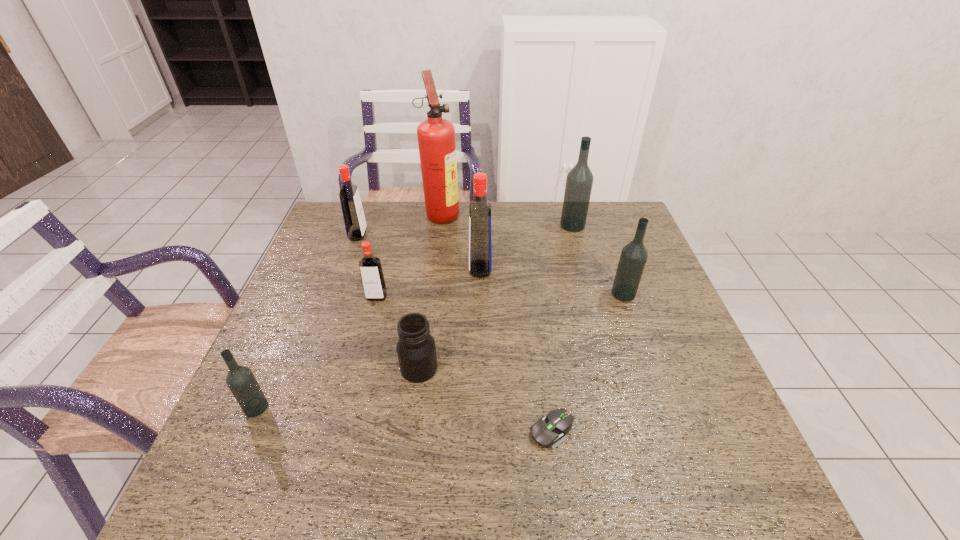
Where is `black vodka that is the second closest one to the jar`? black vodka that is the second closest one to the jar is located at coordinates (634, 255).

Identify the location of red vodka that is the nearest to the second farthest red vodka. Image resolution: width=960 pixels, height=540 pixels. (370, 267).

Identify which red vodka is located as the nearest to the tallest object. Please provide its 2D coordinates. Your answer should be formatted as a tuple, i.e. [(x, y)], where the tuple contains the x and y coordinates of a point satisfying the conditions above.

[(480, 244)]

Where is `free space in the image that satisfies the following two spatial constraints: 1. on the front and back of the rightmost red vodka; 2. on the front and back of the third vodka from left to right`? free space in the image that satisfies the following two spatial constraints: 1. on the front and back of the rightmost red vodka; 2. on the front and back of the third vodka from left to right is located at coordinates tap(480, 297).

You are a GUI agent. You are given a task and a screenshot of the screen. Output one action in this format:
    pyautogui.click(x=<x>, y=<y>)
    Task: Click on the free space that satisfies the following two spatial constraints: 1. on the front-facing side of the tallest object; 2. on the front side of the leftmost black vodka
    Image resolution: width=960 pixels, height=540 pixels.
    Given the screenshot: What is the action you would take?
    pyautogui.click(x=419, y=407)

Identify the location of free spot that satisfies the following two spatial constraints: 1. on the front-facing side of the fire extinguisher; 2. on the front and back of the third object from left to right. The height and width of the screenshot is (540, 960). (432, 297).